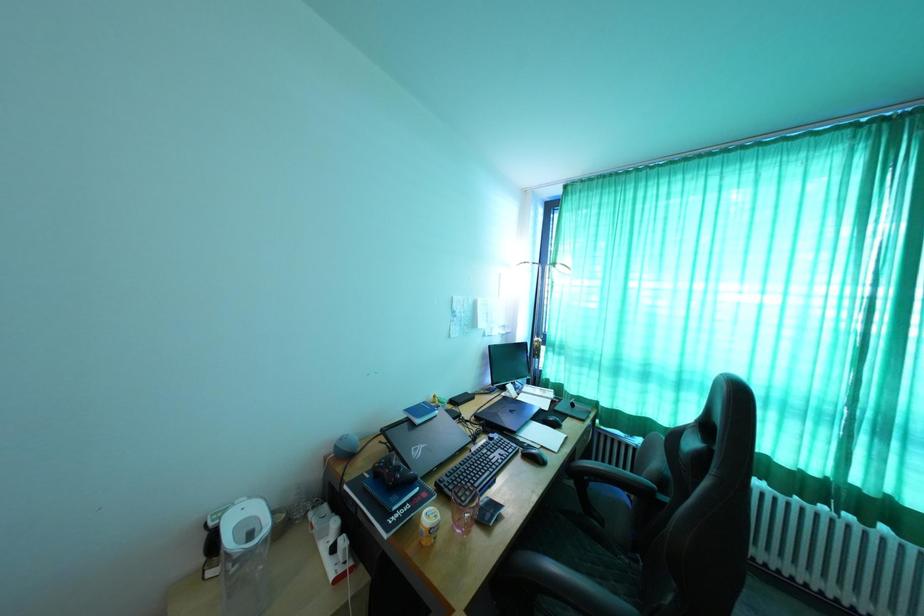
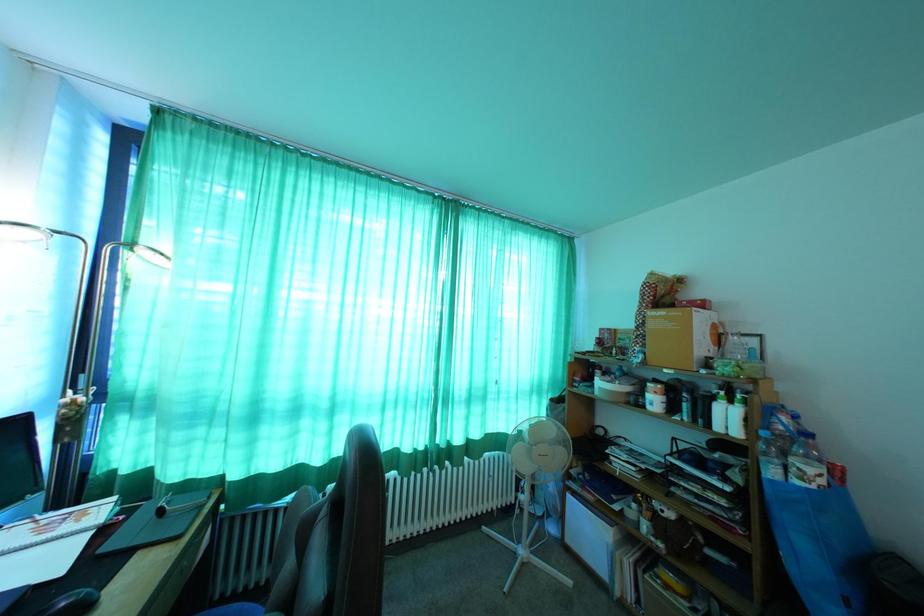
Question: The camera is either moving clockwise (left) or counter-clockwise (right) around the object. The first image is from the beginning of the video and the second image is from the end. Is the camera moving left or right when shooting the video?

Choices:
 (A) Left
 (B) Right

Answer: (A)